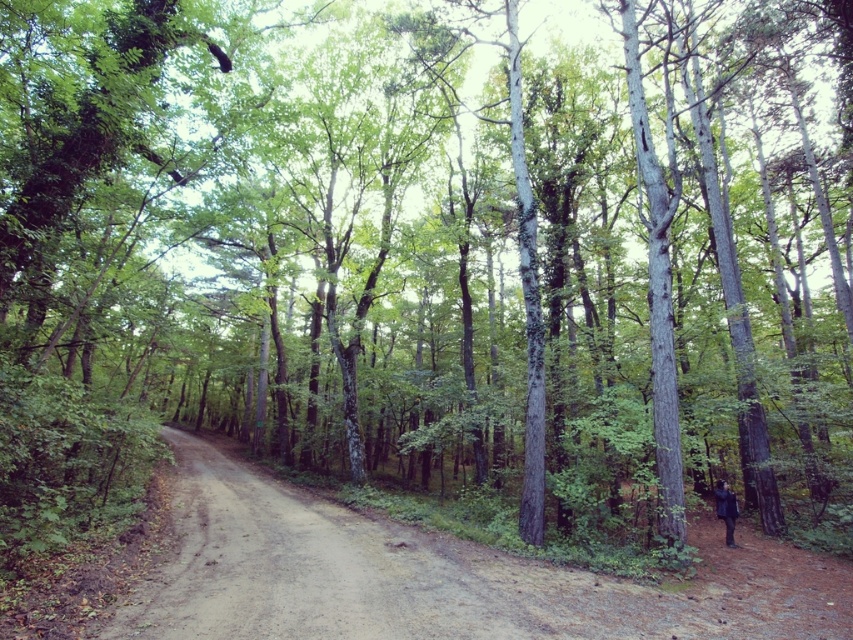
You are a hiker standing at the edge of the forest and see the brown dirt track at center ahead of you. If your backpack has a weight limit of 10 kilograms and you need to reach the track within 5 meters, can you carry a 5kg water bottle and still make it?

The brown dirt track at center is 5.49 meters away. Since the backpack can carry 5kg and you need to reach within 5 meters, the distance is slightly over the limit. Therefore, you cannot reach the track within the required distance.